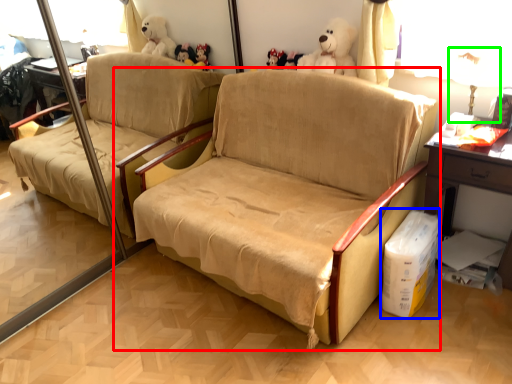
Question: Based on their relative distances, which object is nearer to studio couch (highlighted by a red box)? Choose from cardboard box (highlighted by a blue box) and table lamp (highlighted by a green box).

Choices:
 (A) cardboard box
 (B) table lamp

Answer: (A)